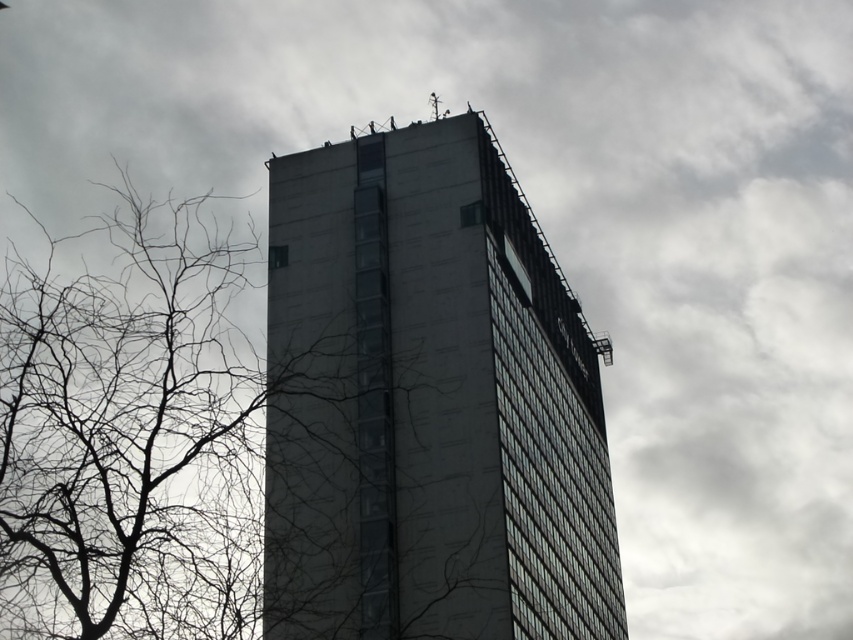
You are standing in front of a tall building and see the point marked at coordinates [428,403]. What does this point indicate?

The point at coordinates [428,403] indicates the dark gray concrete building at center.

You are an architect evaluating a design where the dark gray concrete building at center must be visually balanced with the bare branches at left. Given their sizes, which object would require more strategic placement to achieve balance?

The dark gray concrete building at center has a smaller size compared to the bare branches at left, so it would require more strategic placement to achieve visual balance due to its smaller size.